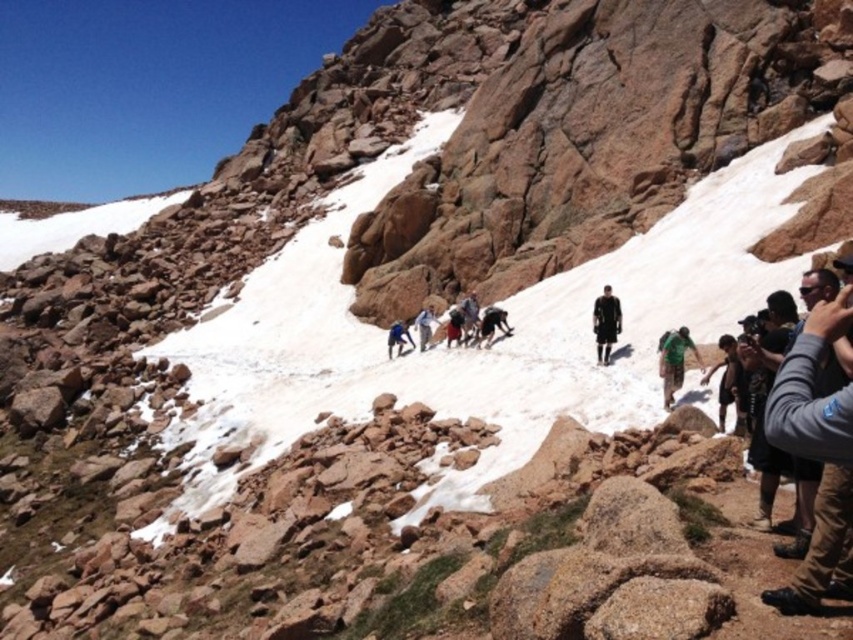
You are a hiker planning to take a photo of the point at coordinates (782, 598). Your camera has a maximum focus range of 40 meters. Will you be able to focus on the point?

The point at coordinates (782, 598) is 41.68 meters from the camera, which exceeds the maximum focus range of 40 meters. Therefore, the camera will not be able to focus on the point.

Consider the image. You are a hiker trying to decide whether to wear your gray fabric jacket at lower right over your green fabric backpack at center. Based on their sizes, which one should you put on first?

The gray fabric jacket at lower right is wider than the green fabric backpack at center, so you should put on the gray fabric jacket at lower right first to avoid difficulty in accessing the backpack afterward.

You are a hiker looking at the scene and notice the gray fabric jacket at lower right and the green fabric backpack at center. Which object is positioned more to the east if the hikers are moving upwards towards the north?

The gray fabric jacket at lower right is to the right of the green fabric backpack at center. Since the hikers are moving north, their right side would be east. Therefore, the gray fabric jacket at lower right is positioned more to the east.